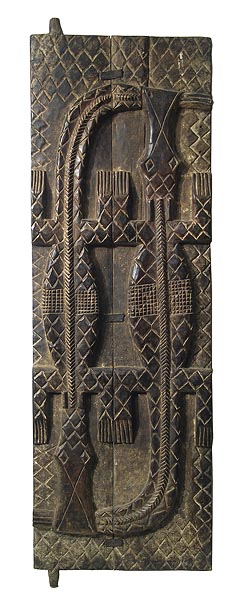
The width and height of the screenshot is (241, 600). Find the location of `divider`. divider is located at coordinates (112, 261).